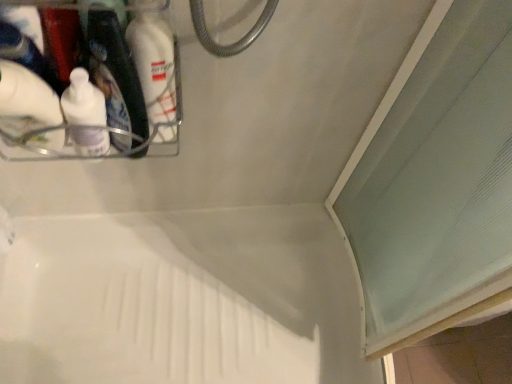
Question: Are white plastic bath at center and white matte bottle at upper left far apart?

Choices:
 (A) no
 (B) yes

Answer: (A)

Question: From the image's perspective, would you say white plastic bath at center is positioned over white matte bottle at upper left?

Choices:
 (A) yes
 (B) no

Answer: (B)

Question: Considering the relative positions of white plastic bath at center and white matte bottle at upper left in the image provided, is white plastic bath at center to the right of white matte bottle at upper left from the viewer's perspective?

Choices:
 (A) no
 (B) yes

Answer: (B)

Question: Considering the relative sizes of white plastic bath at center and white matte bottle at upper left in the image provided, is white plastic bath at center wider than white matte bottle at upper left?

Choices:
 (A) no
 (B) yes

Answer: (B)

Question: From a real-world perspective, does white plastic bath at center sit lower than white matte bottle at upper left?

Choices:
 (A) yes
 (B) no

Answer: (A)

Question: From the image's perspective, is white plastic bath at center above or below white matte bottle at upper left?

Choices:
 (A) above
 (B) below

Answer: (B)

Question: Is white plastic bath at center wider or thinner than white matte bottle at upper left?

Choices:
 (A) thin
 (B) wide

Answer: (B)

Question: Is white plastic bath at center spatially inside white matte bottle at upper left, or outside of it?

Choices:
 (A) outside
 (B) inside

Answer: (A)

Question: Based on their positions, is white plastic bath at center located to the left or right of white matte bottle at upper left?

Choices:
 (A) right
 (B) left

Answer: (A)

Question: Is point (22, 104) closer or farther from the camera than point (170, 120)?

Choices:
 (A) closer
 (B) farther

Answer: (A)

Question: Is white matte bottle at upper left spatially inside white matte bottle at upper left, or outside of it?

Choices:
 (A) outside
 (B) inside

Answer: (A)

Question: From the image's perspective, is white matte bottle at upper left located above or below white matte bottle at upper left?

Choices:
 (A) above
 (B) below

Answer: (B)

Question: In terms of width, does white matte bottle at upper left look wider or thinner when compared to white matte bottle at upper left?

Choices:
 (A) thin
 (B) wide

Answer: (A)

Question: Relative to white plastic bath at center, is white matte bottle at upper left in front or behind?

Choices:
 (A) front
 (B) behind

Answer: (A)

Question: From a real-world perspective, relative to white plastic bath at center, is white matte bottle at upper left vertically above or below?

Choices:
 (A) above
 (B) below

Answer: (A)